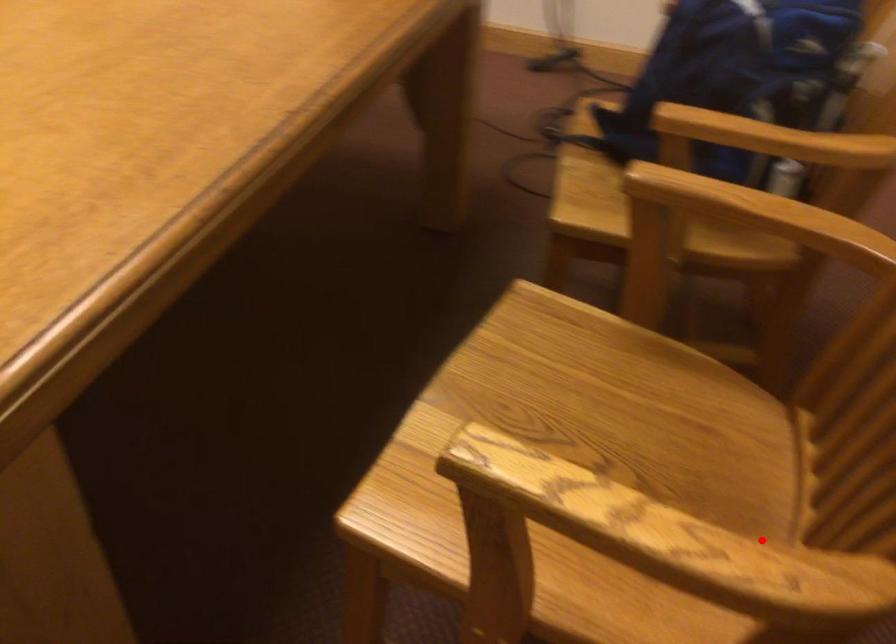
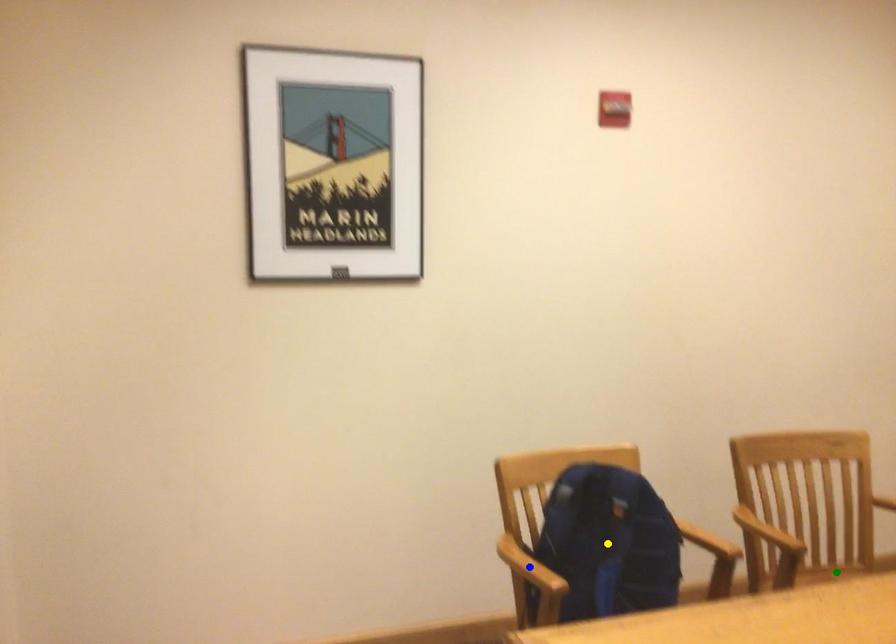
Question: I am providing you with two images of the same scene from different viewpoints. A red point is marked on the first image. You are given multiple points on the second image. Which mark in image 2 goes with the point in image 1?

Choices:
 (A) green point
 (B) blue point
 (C) yellow point

Answer: (A)